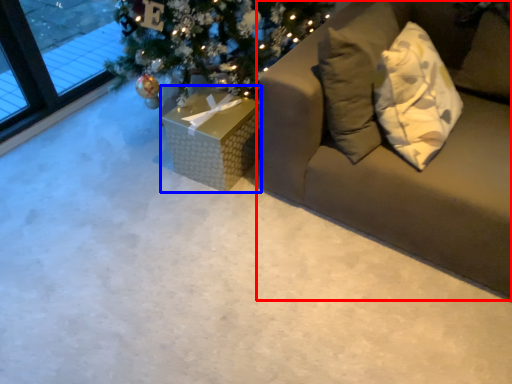
Question: Which object appears closest to the camera in this image, studio couch (highlighted by a red box) or furniture (highlighted by a blue box)?

Choices:
 (A) studio couch
 (B) furniture

Answer: (A)